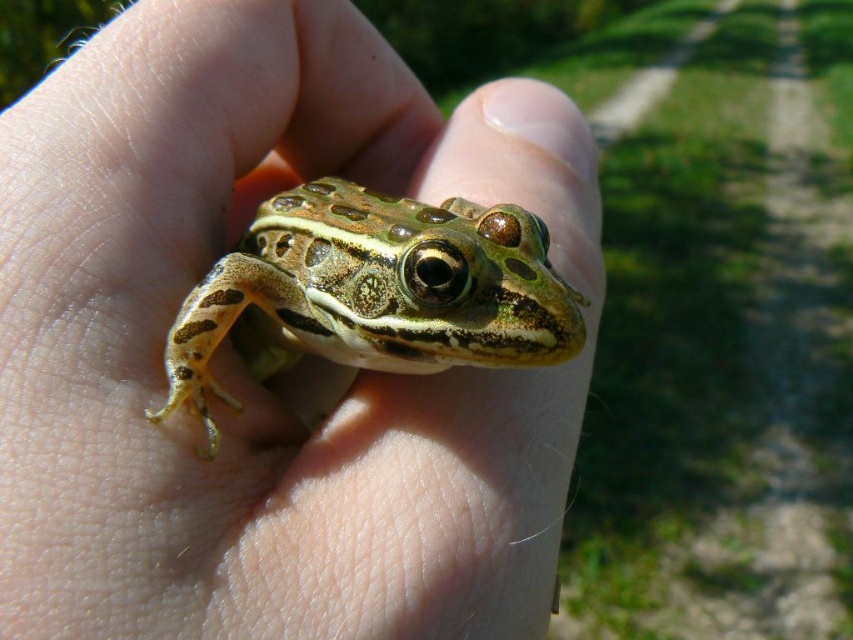
Does green matte skin at center have a greater width compared to green spotted skin at center?

Correct, the width of green matte skin at center exceeds that of green spotted skin at center.

Does green matte skin at center appear under green spotted skin at center?

Yes, green matte skin at center is below green spotted skin at center.

Which is behind, point (154, 497) or point (432, 328)?

The point (432, 328) is more distant.

Locate an element on the screen. Image resolution: width=853 pixels, height=640 pixels. green matte skin at center is located at coordinates (241, 365).